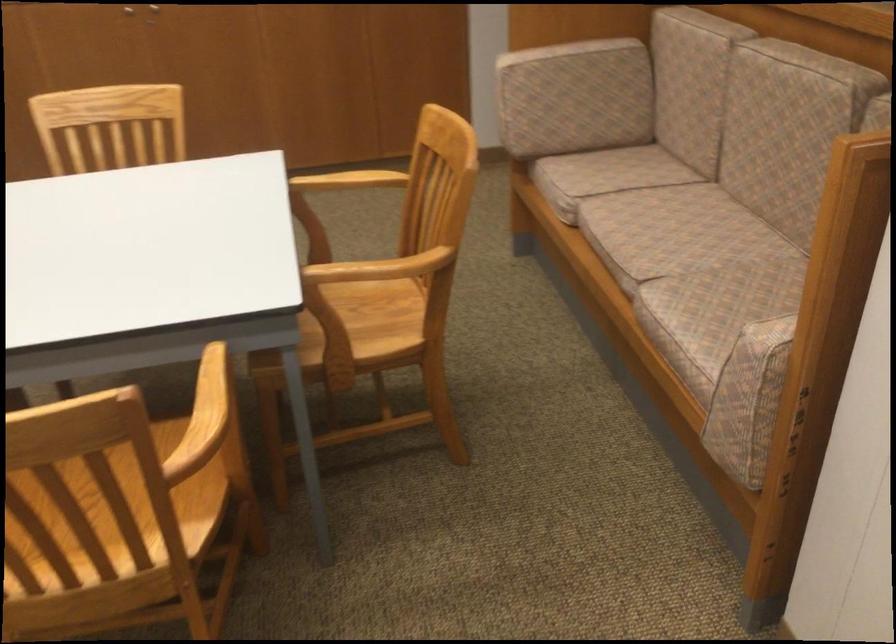
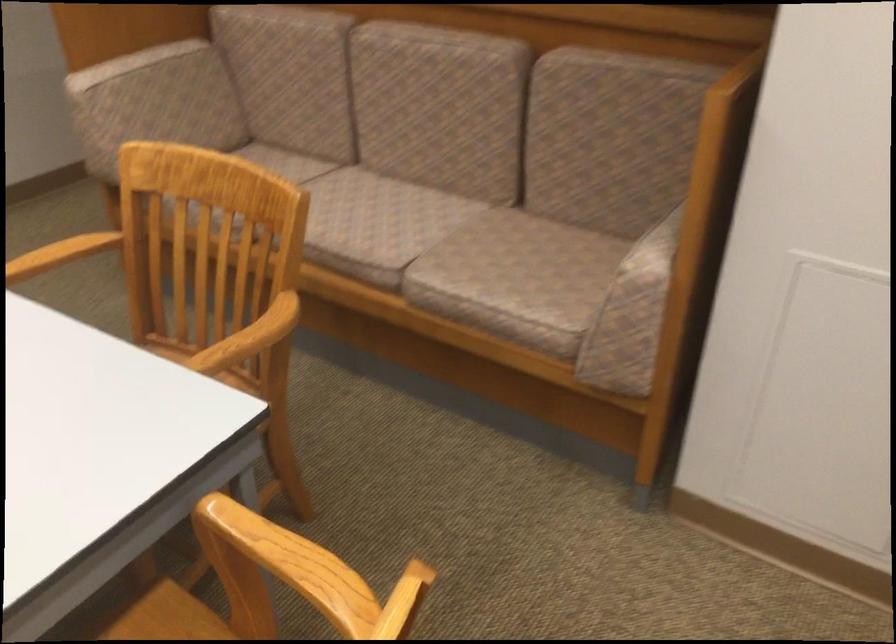
Locate, in the second image, the point that corresponds to pixel 365 172 in the first image.

(62, 252)